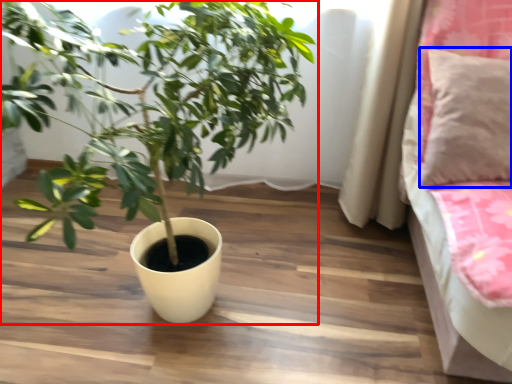
Question: Which of the following is the closest to the observer, houseplant (highlighted by a red box) or pillow (highlighted by a blue box)?

Choices:
 (A) houseplant
 (B) pillow

Answer: (A)